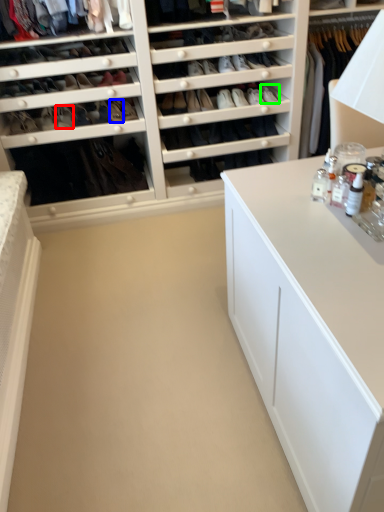
Question: Considering the real-world distances, which object is closest to shoe (highlighted by a red box)? shoe (highlighted by a blue box) or shoe (highlighted by a green box).

Choices:
 (A) shoe
 (B) shoe

Answer: (A)